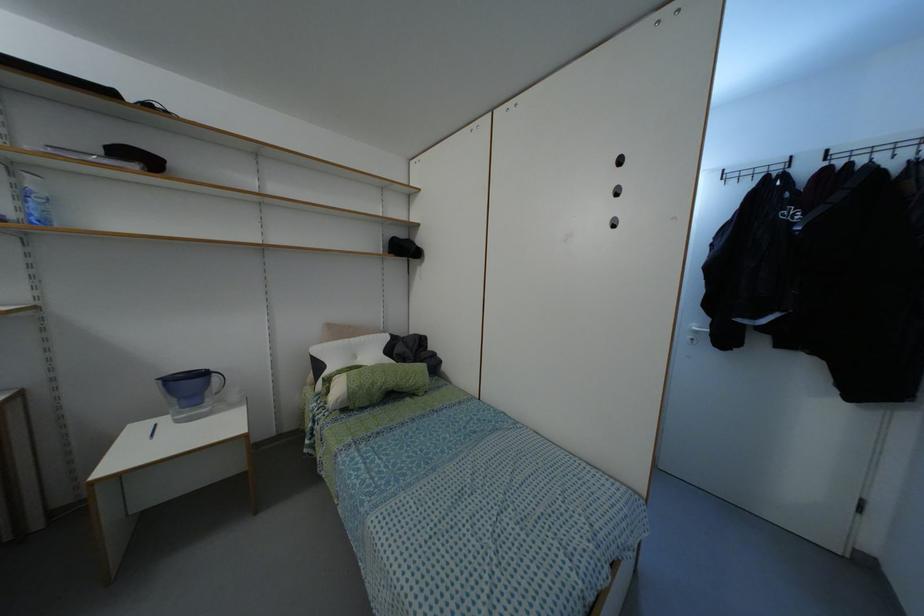
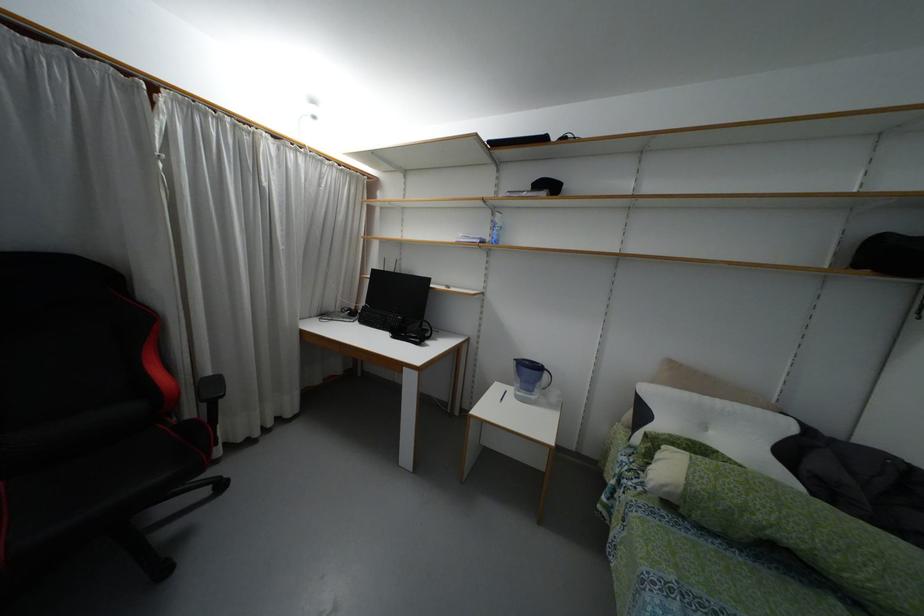
The point at [345,339] is marked in the first image. Where is the corresponding point in the second image?

(695, 395)